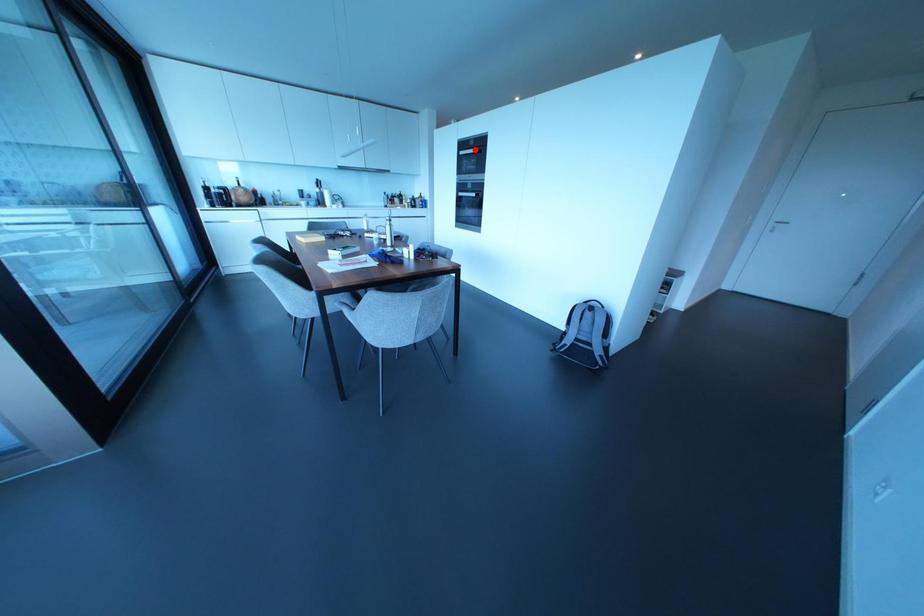
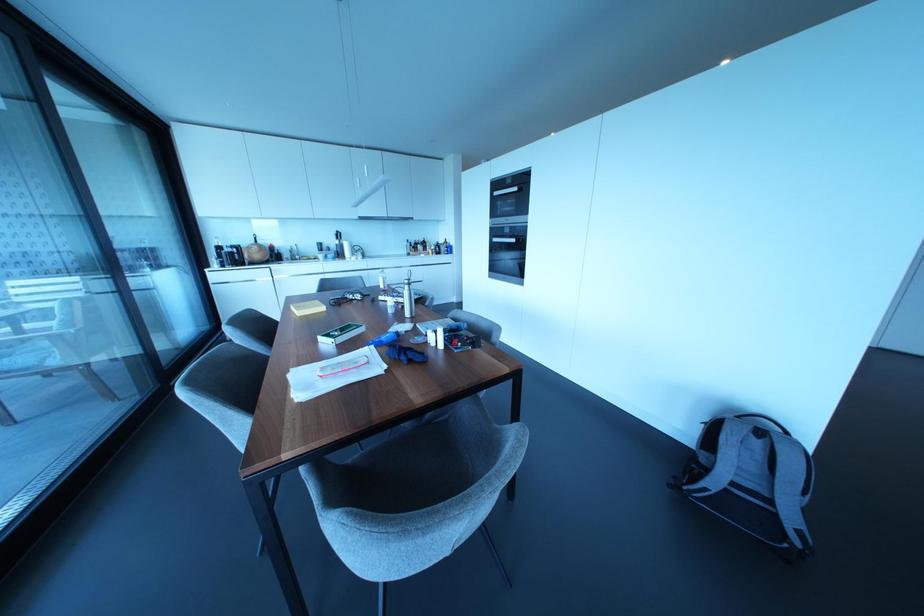
Question: I am providing you with two images of the same scene from different viewpoints. In image1, a red point is highlighted. Considering the same 3D point in image2, which of the following is correct?

Choices:
 (A) It is closer
 (B) It is farther

Answer: (B)